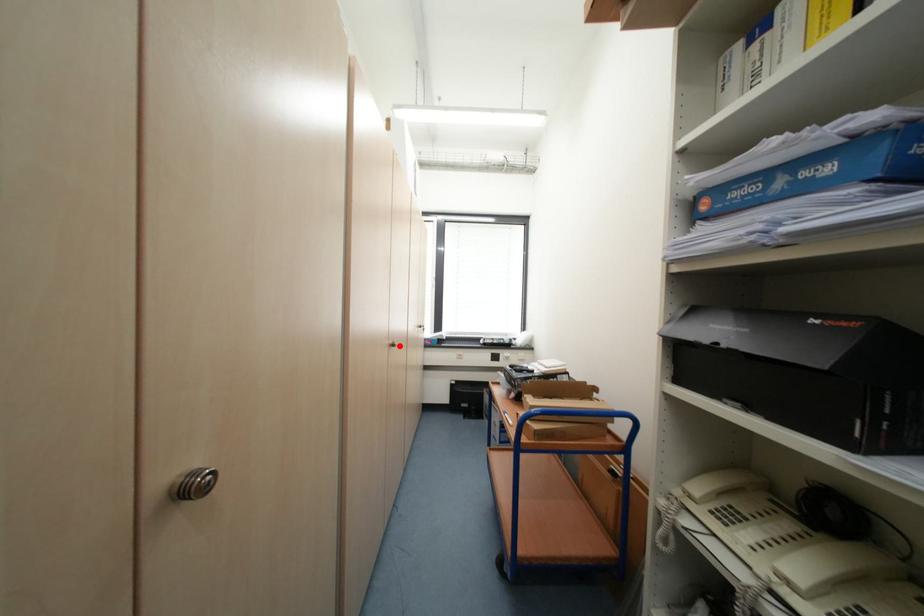
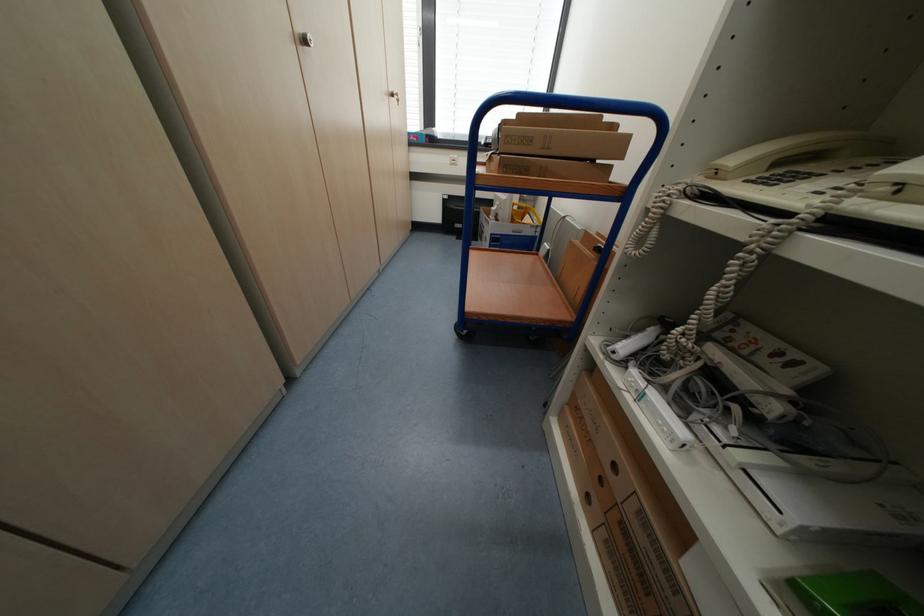
Question: I am providing you with two images of the same scene from different viewpoints. In image1, a red point is highlighted. Considering the same 3D point in image2, which of the following is correct?

Choices:
 (A) It is closer
 (B) It is farther

Answer: (B)